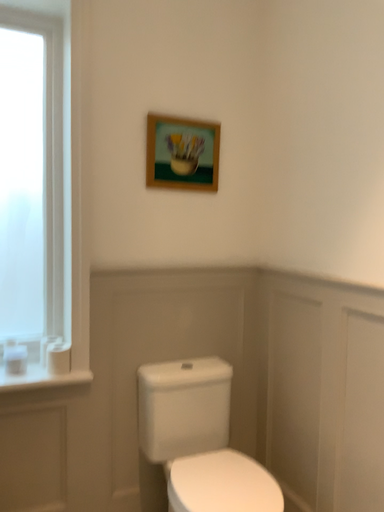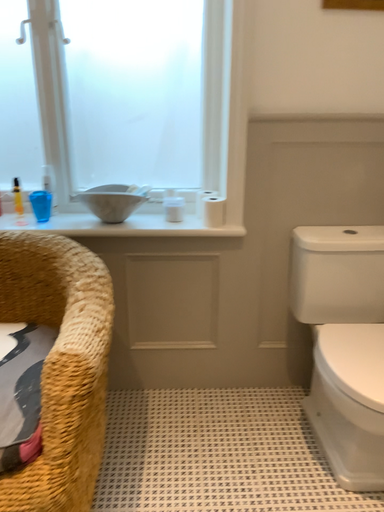
Question: Which way did the camera rotate in the video?

Choices:
 (A) rotated downward
 (B) rotated upward

Answer: (A)